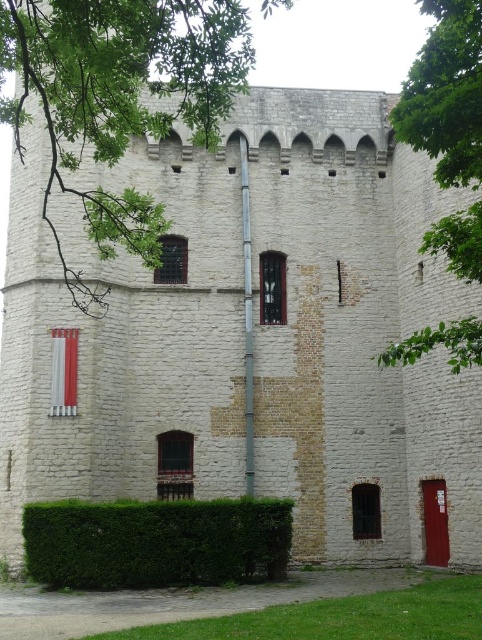
Question: Estimate the real-world distances between objects in this image. Which object is farther from the green leafy hedge at lower left?

Choices:
 (A) green leafy tree at upper left
 (B) green leafy tree at upper right

Answer: (A)

Question: Which of the following is the farthest from the observer?

Choices:
 (A) green leafy tree at upper right
 (B) green leafy hedge at lower left

Answer: (B)

Question: Is green leafy tree at upper left below green leafy hedge at lower left?

Choices:
 (A) no
 (B) yes

Answer: (A)

Question: Can you confirm if green leafy tree at upper left is positioned to the left of green leafy hedge at lower left?

Choices:
 (A) no
 (B) yes

Answer: (B)

Question: Does green leafy tree at upper left have a larger size compared to green leafy tree at upper right?

Choices:
 (A) yes
 (B) no

Answer: (A)

Question: Which point is farther from the camera taking this photo?

Choices:
 (A) (481, 35)
 (B) (83, 285)
 (C) (139, 556)

Answer: (B)